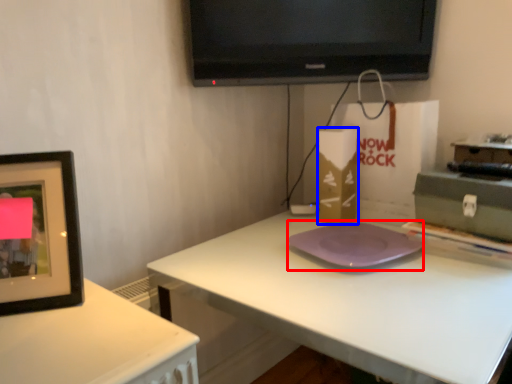
Question: Which point is closer to the camera, pad (highlighted by a red box) or cardboard box (highlighted by a blue box)?

Choices:
 (A) pad
 (B) cardboard box

Answer: (A)